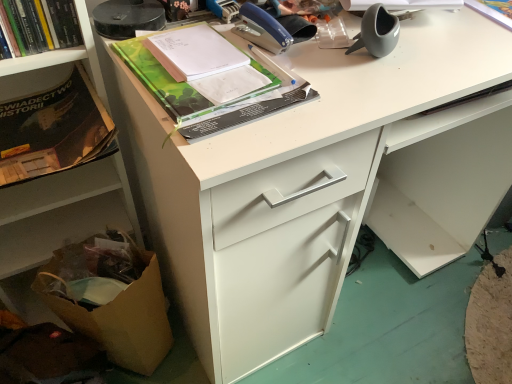
At what (x,y) coordinates should I click in order to perform the action: click on vacant space in front of matte gray vase at upper right, the 1th office supplies positioned from the right. Please return your answer as a coordinate pair (x, y). Looking at the image, I should click on (374, 89).